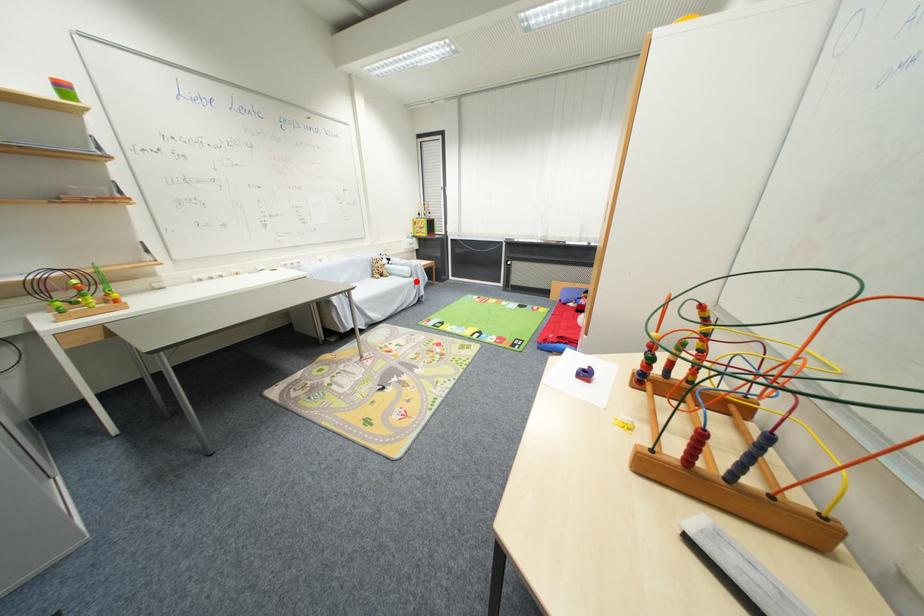
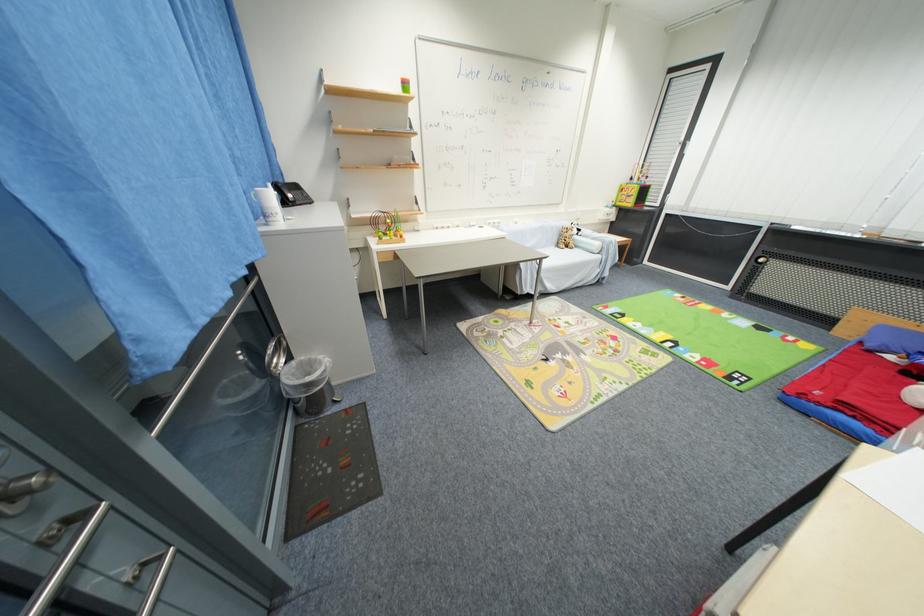
In the second image, find the point that corresponds to the highlighted location in the first image.

(603, 259)